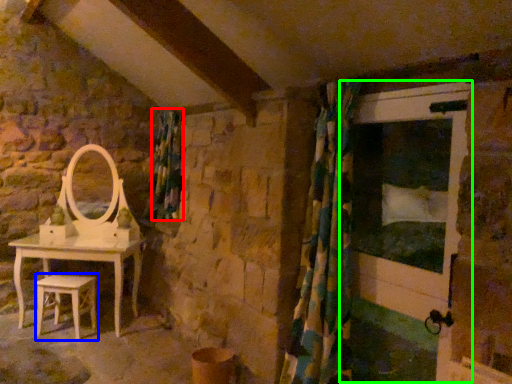
Question: Which is nearer to the curtain (highlighted by a red box)? stool (highlighted by a blue box) or screen door (highlighted by a green box).

Choices:
 (A) stool
 (B) screen door

Answer: (A)